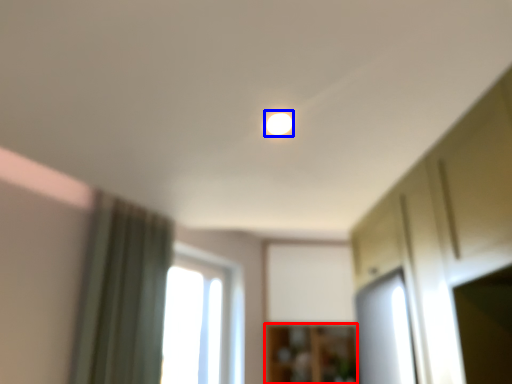
Question: Among these objects, which one is farthest to the camera, cabinetry (highlighted by a red box) or light (highlighted by a blue box)?

Choices:
 (A) cabinetry
 (B) light

Answer: (A)